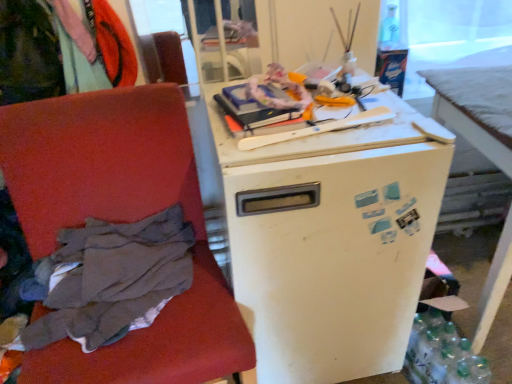
Question: From the image's perspective, is dark gray fabric at left, which is the 2th clothing from top to bottom, on top of white matte desk at right?

Choices:
 (A) yes
 (B) no

Answer: (B)

Question: Is dark gray fabric at left, the 1th clothing positioned from the right, oriented away from white matte desk at right?

Choices:
 (A) yes
 (B) no

Answer: (B)

Question: Can you confirm if dark gray fabric at left, the 1th clothing positioned from the right, is positioned to the left of white matte desk at right?

Choices:
 (A) yes
 (B) no

Answer: (A)

Question: From a real-world perspective, is dark gray fabric at left, acting as the 2th clothing starting from the left, located higher than white matte desk at right?

Choices:
 (A) no
 (B) yes

Answer: (B)

Question: Is dark gray fabric at left, the 1th clothing positioned from the right, smaller than white matte desk at right?

Choices:
 (A) no
 (B) yes

Answer: (B)

Question: From the image's perspective, relative to velvet-like red chair at left, is white matte refrigerator at center above or below?

Choices:
 (A) above
 (B) below

Answer: (A)

Question: Is white matte refrigerator at center taller or shorter than velvet-like red chair at left?

Choices:
 (A) short
 (B) tall

Answer: (A)

Question: From a real-world perspective, is white matte refrigerator at center positioned above or below velvet-like red chair at left?

Choices:
 (A) below
 (B) above

Answer: (A)

Question: Looking at their shapes, would you say white matte refrigerator at center is wider or thinner than velvet-like red chair at left?

Choices:
 (A) thin
 (B) wide

Answer: (B)

Question: Does point (267, 137) appear closer or farther from the camera than point (430, 316)?

Choices:
 (A) farther
 (B) closer

Answer: (B)

Question: From the image's perspective, is wooden skateboard at upper center positioned above or below clear plastic bottles at lower right?

Choices:
 (A) above
 (B) below

Answer: (A)

Question: Considering the positions of wooden skateboard at upper center and clear plastic bottles at lower right in the image, is wooden skateboard at upper center wider or thinner than clear plastic bottles at lower right?

Choices:
 (A) wide
 (B) thin

Answer: (B)

Question: Considering the positions of wooden skateboard at upper center and clear plastic bottles at lower right in the image, is wooden skateboard at upper center bigger or smaller than clear plastic bottles at lower right?

Choices:
 (A) small
 (B) big

Answer: (A)

Question: In the image, is velvet-like fabric at upper left, which is the second clothing in bottom-to-top order, on the left side or the right side of white matte desk at right?

Choices:
 (A) right
 (B) left

Answer: (B)

Question: From the image's perspective, is velvet-like fabric at upper left, which is the second clothing in bottom-to-top order, located above or below white matte desk at right?

Choices:
 (A) above
 (B) below

Answer: (A)